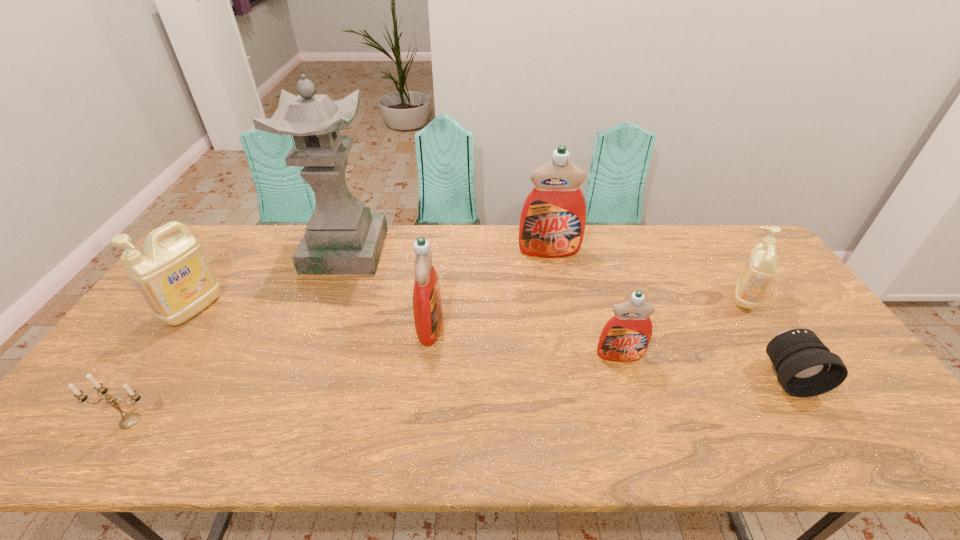
Where is `object that is at the near left corner`? The image size is (960, 540). object that is at the near left corner is located at coordinates click(129, 420).

The image size is (960, 540). I want to click on vacant space at the far edge, so click(278, 248).

This screenshot has width=960, height=540. In the image, there is a desktop. What are the coordinates of `vacant space at the near edge` in the screenshot? It's located at (523, 426).

The height and width of the screenshot is (540, 960). In order to click on vacant space at the left edge in this screenshot , I will do click(x=132, y=333).

At what (x,y) coordinates should I click in order to perform the action: click on vacant space at the far right corner. Please return your answer as a coordinate pair (x, y). The height and width of the screenshot is (540, 960). Looking at the image, I should click on (722, 245).

This screenshot has width=960, height=540. I want to click on empty location between the smallest red detergent and the left beige detergent, so point(407,332).

I want to click on free spot between the gray sculpture and the metallic candle, so click(238, 336).

This screenshot has height=540, width=960. I want to click on vacant space in between the gray sculpture and the metallic candle, so click(x=238, y=336).

Locate an element on the screen. vacant space in between the fourth object from left to right and the smaller beige detergent is located at coordinates (588, 312).

Where is `vacant area that lies between the leftmost detergent and the seventh tallest object`? This screenshot has height=540, width=960. vacant area that lies between the leftmost detergent and the seventh tallest object is located at coordinates [x=162, y=365].